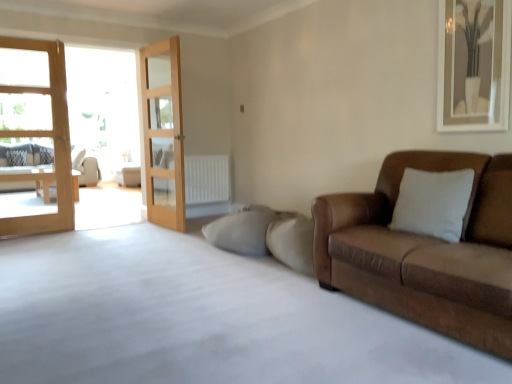
Question: From the image's perspective, is white textured pillow at left beneath wooden glass door at center, arranged as the first door when viewed from the right?

Choices:
 (A) no
 (B) yes

Answer: (A)

Question: Is white textured pillow at left directly adjacent to wooden glass door at center, arranged as the 2th door when viewed from the left?

Choices:
 (A) no
 (B) yes

Answer: (A)

Question: Is white textured pillow at left shorter than wooden glass door at center, arranged as the 2th door when viewed from the left?

Choices:
 (A) yes
 (B) no

Answer: (A)

Question: Would you say white textured pillow at left is a long distance from wooden glass door at center, arranged as the first door when viewed from the right?

Choices:
 (A) yes
 (B) no

Answer: (A)

Question: Does white textured pillow at left have a greater height compared to wooden glass door at center, arranged as the first door when viewed from the right?

Choices:
 (A) yes
 (B) no

Answer: (B)

Question: Can you confirm if white textured pillow at left is smaller than wooden glass door at center, arranged as the first door when viewed from the right?

Choices:
 (A) yes
 (B) no

Answer: (A)

Question: Are beige fabric couch at left, the 1th studio couch in the back-to-front sequence, and wooden glass door at center, arranged as the first door when viewed from the right, beside each other?

Choices:
 (A) no
 (B) yes

Answer: (A)

Question: Is beige fabric couch at left, positioned as the second studio couch in right-to-left order, positioned in front of wooden glass door at center, arranged as the 2th door when viewed from the left?

Choices:
 (A) yes
 (B) no

Answer: (B)

Question: Is beige fabric couch at left, the 1th studio couch in the left-to-right sequence, taller than wooden glass door at center, arranged as the 2th door when viewed from the left?

Choices:
 (A) no
 (B) yes

Answer: (A)

Question: Can you confirm if beige fabric couch at left, the 2th studio couch positioned from the front, is positioned to the left of wooden glass door at center, arranged as the 2th door when viewed from the left?

Choices:
 (A) no
 (B) yes

Answer: (B)

Question: From the image's perspective, is beige fabric couch at left, the 2th studio couch positioned from the front, on wooden glass door at center, arranged as the first door when viewed from the right?

Choices:
 (A) yes
 (B) no

Answer: (B)

Question: Is wooden glass door at center, arranged as the 2th door when viewed from the left, completely or partially inside beige fabric couch at left, the 2th studio couch positioned from the front?

Choices:
 (A) no
 (B) yes

Answer: (A)

Question: Does wooden glass door at center, arranged as the first door when viewed from the right, come in front of beige fabric couch at left, the 2th studio couch positioned from the front?

Choices:
 (A) no
 (B) yes

Answer: (B)